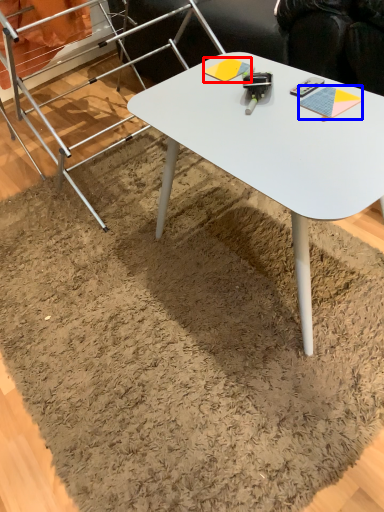
Question: Among these objects, which one is farthest to the camera, notepad (highlighted by a red box) or notepad (highlighted by a blue box)?

Choices:
 (A) notepad
 (B) notepad

Answer: (A)